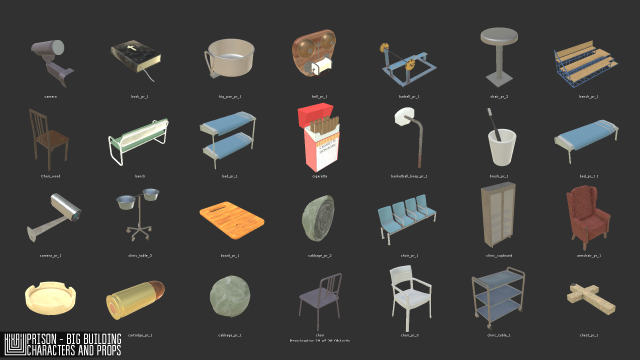
Locate an element on the screen. The width and height of the screenshot is (640, 360). types of chairs is located at coordinates pos(502,34), pos(317,297), pos(410,221), pos(419,302), pos(589,64), pos(586,234), pos(143,136), pos(44,128).